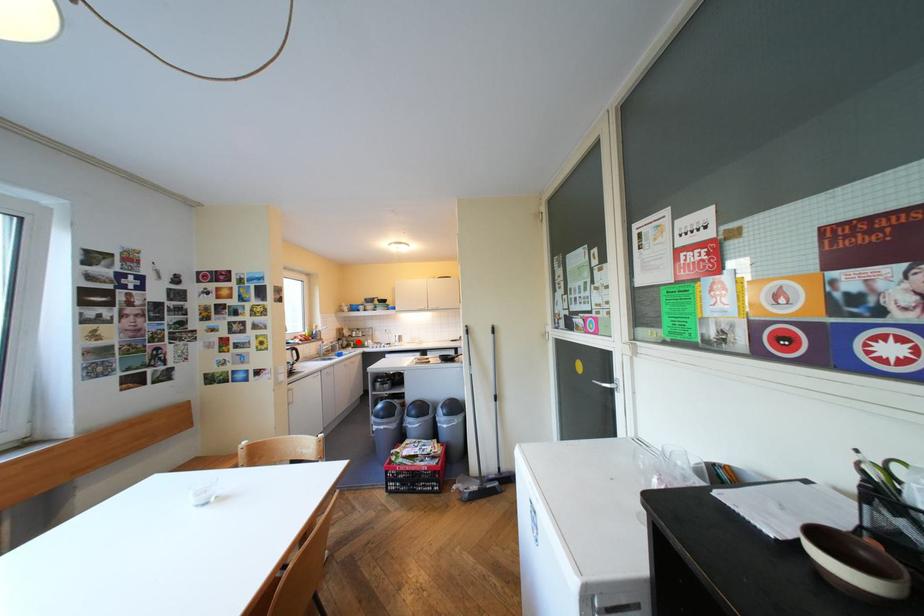
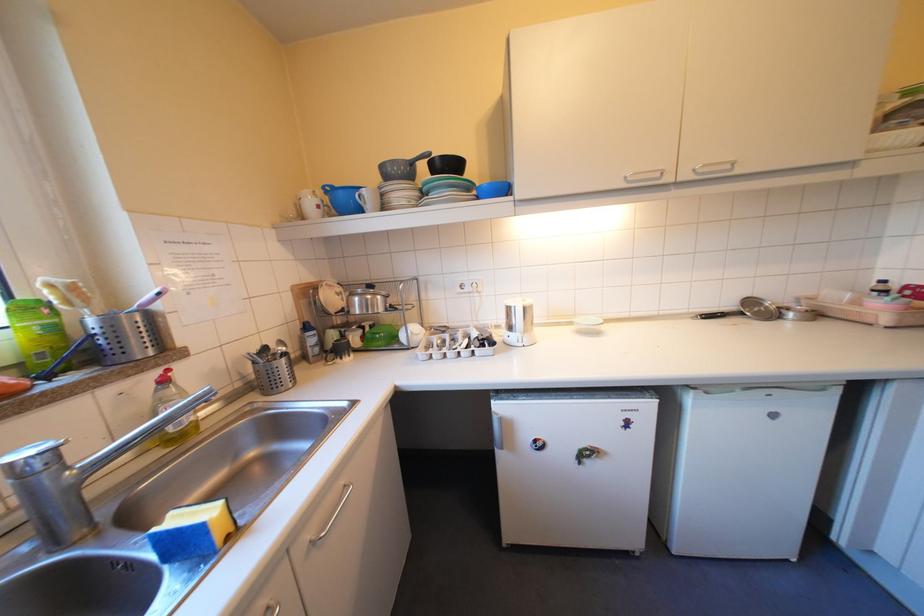
The point at the highlighted location is marked in the first image. Where is the corresponding point in the second image?

(346, 334)